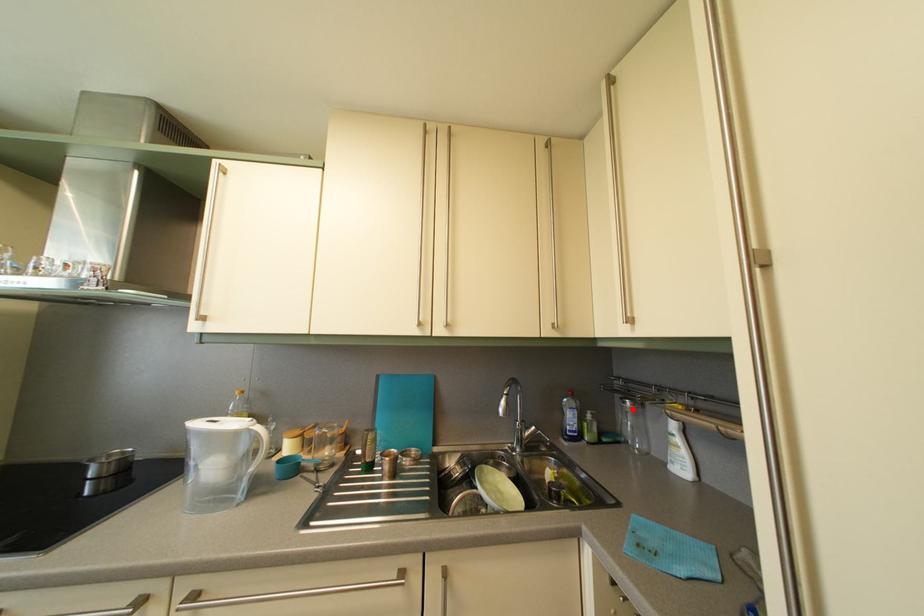
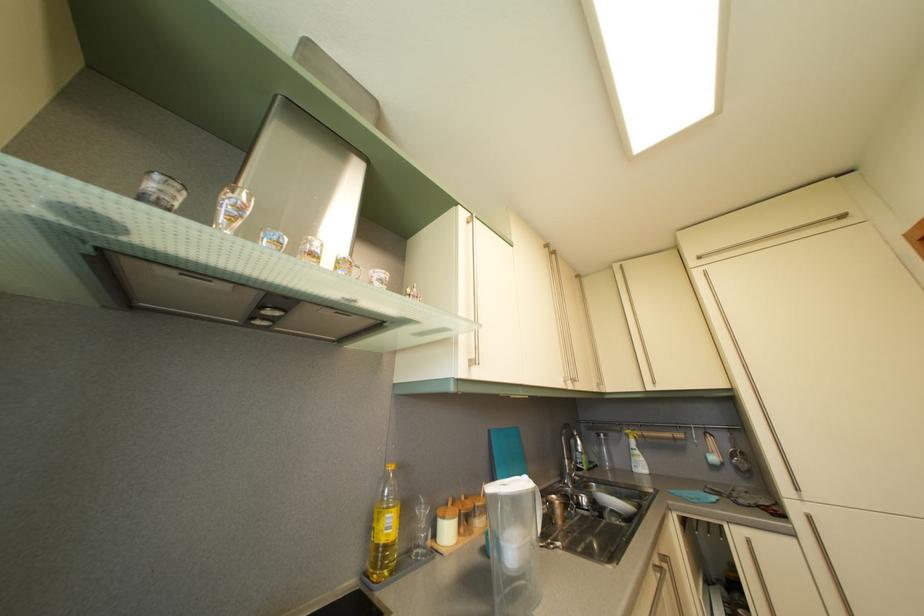
Locate, in the second image, the point that corresponds to the highlighted location in the first image.

(608, 444)